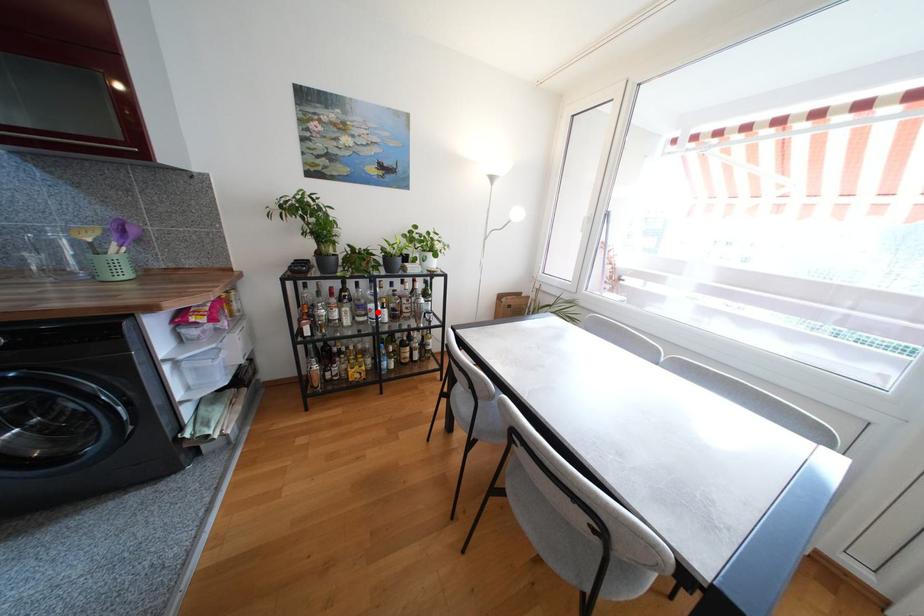
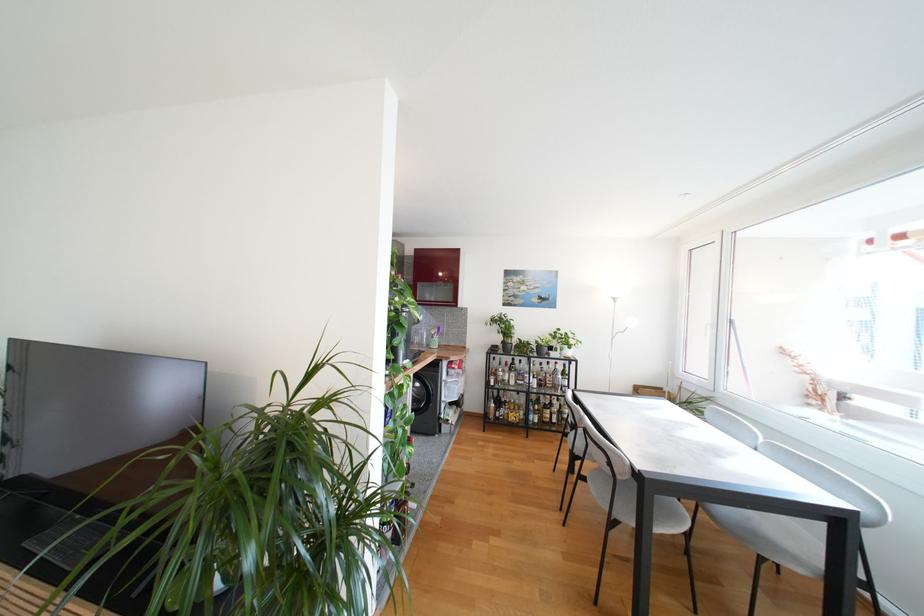
Question: I am providing you with two images of the same scene from different viewpoints. A red point is marked on the first image. Can you still see the location of the red point in image 2?

Choices:
 (A) Yes
 (B) No

Answer: (A)